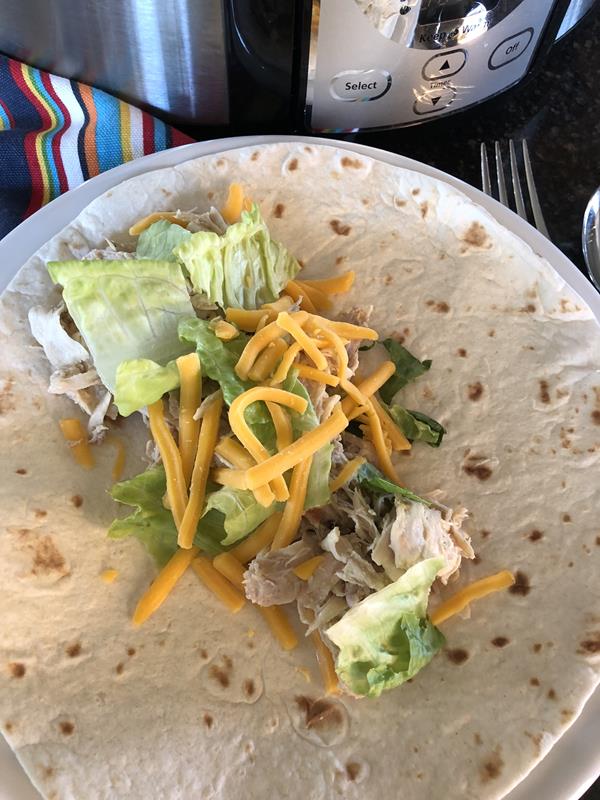
Identify the location of plate. (565, 765).